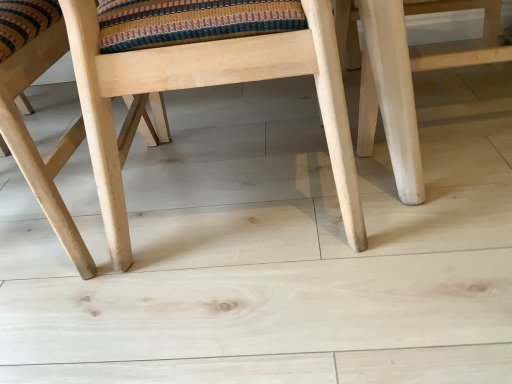
The image size is (512, 384). What are the coordinates of `vacant space that is in between natural wood chair at center, which ranks as the 1th chair in left-to-right order, and natural wood chair at center, the second chair from the left` in the screenshot? It's located at (176, 246).